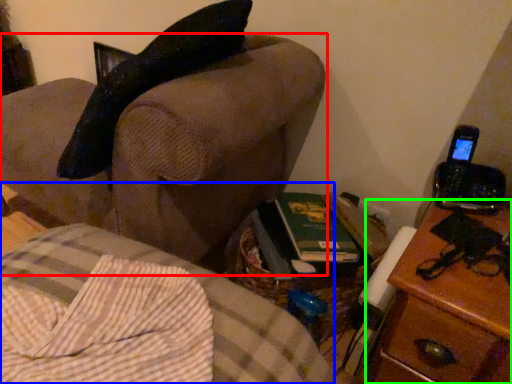
Question: Estimate the real-world distances between objects in this image. Which object is closer to furniture (highlighted by a red box), furniture (highlighted by a blue box) or nightstand (highlighted by a green box)?

Choices:
 (A) furniture
 (B) nightstand

Answer: (A)